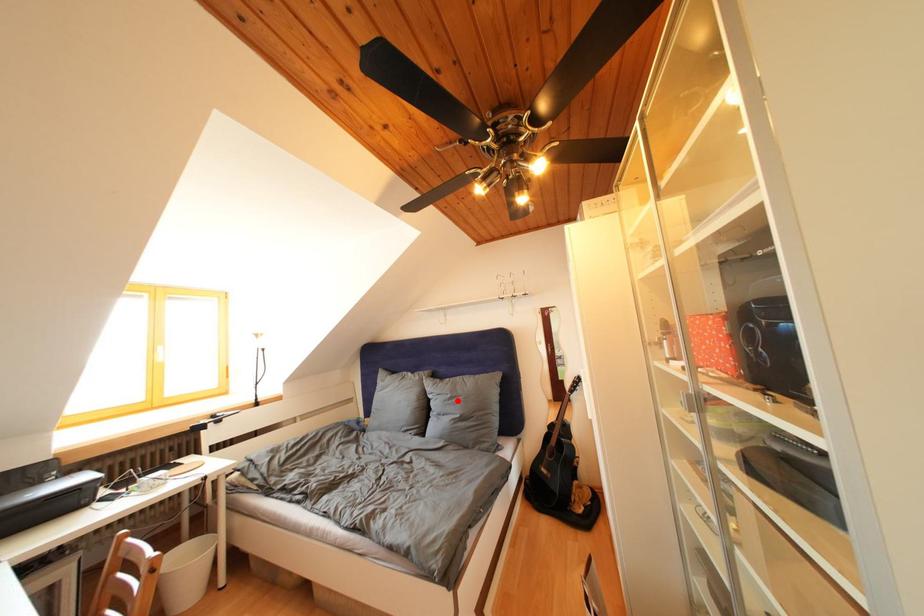
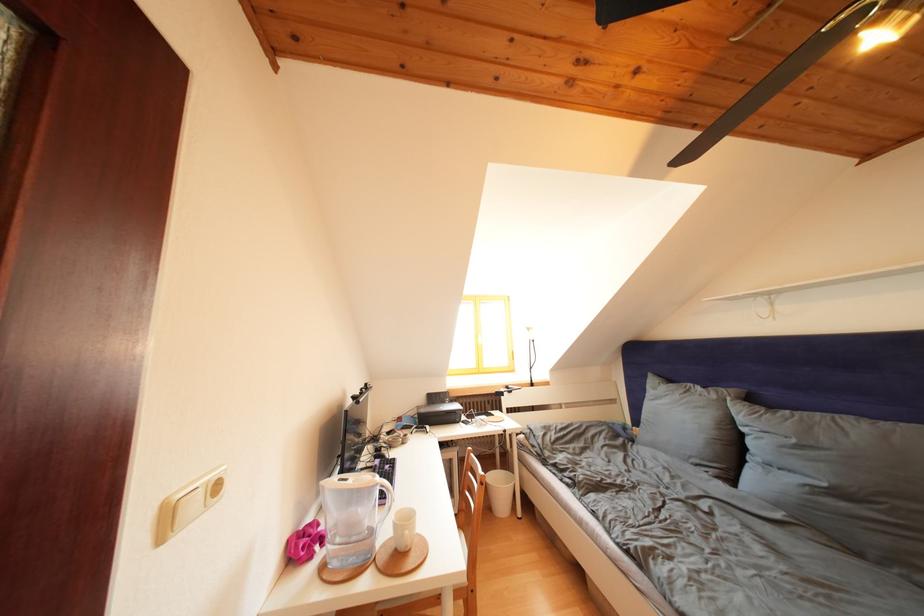
Question: I am providing you with two images of the same scene from different viewpoints. In image1, a red point is highlighted. Considering the same 3D point in image2, which of the following is correct?

Choices:
 (A) It is closer
 (B) It is farther

Answer: (A)